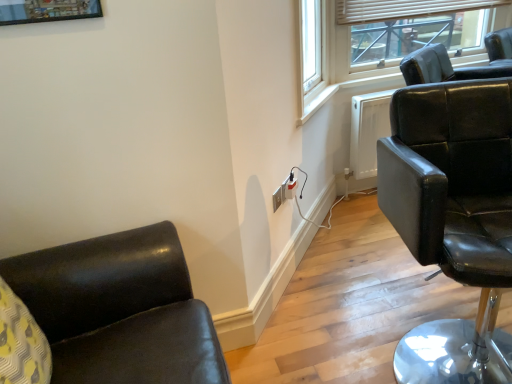
Question: Considering the relative sizes of white plastic outlet at center, the second electric outlet in the right-to-left sequence, and matte black chair at right in the image provided, is white plastic outlet at center, the second electric outlet in the right-to-left sequence, bigger than matte black chair at right?

Choices:
 (A) no
 (B) yes

Answer: (A)

Question: From a real-world perspective, is white plastic outlet at center, which ranks as the first electric outlet in front-to-back order, below matte black chair at right?

Choices:
 (A) yes
 (B) no

Answer: (A)

Question: Is white plastic outlet at center, which ranks as the first electric outlet in front-to-back order, completely or partially outside of matte black chair at right?

Choices:
 (A) yes
 (B) no

Answer: (A)

Question: Would you consider white plastic outlet at center, the second electric outlet in the right-to-left sequence, to be distant from matte black chair at right?

Choices:
 (A) yes
 (B) no

Answer: (B)

Question: From the image's perspective, does white plastic outlet at center, the second electric outlet viewed from the back, appear higher than matte black chair at right?

Choices:
 (A) yes
 (B) no

Answer: (A)

Question: Considering the relative sizes of white plastic outlet at center, the second electric outlet in the right-to-left sequence, and matte black chair at right in the image provided, is white plastic outlet at center, the second electric outlet in the right-to-left sequence, thinner than matte black chair at right?

Choices:
 (A) yes
 (B) no

Answer: (A)

Question: Does matte black socket at lower right, which appears as the 1th electric outlet when viewed from the right, appear on the left side of matte black chair at right?

Choices:
 (A) no
 (B) yes

Answer: (B)

Question: Does matte black socket at lower right, the 1th electric outlet positioned from the back, come in front of matte black chair at right?

Choices:
 (A) no
 (B) yes

Answer: (A)

Question: Is matte black socket at lower right, which is the 2th electric outlet in left-to-right order, smaller than matte black chair at right?

Choices:
 (A) yes
 (B) no

Answer: (A)

Question: Is matte black socket at lower right, the 1th electric outlet positioned from the back, outside of matte black chair at right?

Choices:
 (A) no
 (B) yes

Answer: (B)

Question: From the image's perspective, is matte black socket at lower right, the 2th electric outlet viewed from the front, under matte black chair at right?

Choices:
 (A) no
 (B) yes

Answer: (A)

Question: Is matte black chair at right at the back of matte black socket at lower right, which is the 2th electric outlet in left-to-right order?

Choices:
 (A) no
 (B) yes

Answer: (A)

Question: Is matte black chair at upper right turned away from white plastic outlet at center, which ranks as the first electric outlet in front-to-back order?

Choices:
 (A) no
 (B) yes

Answer: (A)